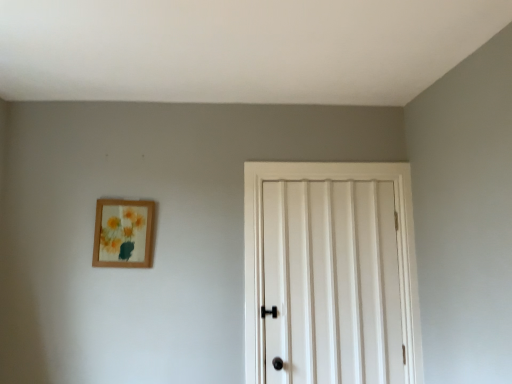
Question: Does wooden picture frame at upper left appear on the left side of white matte door at center?

Choices:
 (A) yes
 (B) no

Answer: (A)

Question: Is wooden picture frame at upper left located outside white matte door at center?

Choices:
 (A) yes
 (B) no

Answer: (A)

Question: Is wooden picture frame at upper left with white matte door at center?

Choices:
 (A) no
 (B) yes

Answer: (A)

Question: Can white matte door at center be found inside wooden picture frame at upper left?

Choices:
 (A) yes
 (B) no

Answer: (B)

Question: Considering the relative sizes of wooden picture frame at upper left and white matte door at center in the image provided, is wooden picture frame at upper left wider than white matte door at center?

Choices:
 (A) yes
 (B) no

Answer: (B)

Question: Considering the relative sizes of wooden picture frame at upper left and white matte door at center in the image provided, is wooden picture frame at upper left bigger than white matte door at center?

Choices:
 (A) yes
 (B) no

Answer: (B)

Question: Is white matte door at center positioned in front of wooden picture frame at upper left?

Choices:
 (A) no
 (B) yes

Answer: (B)

Question: Is there a large distance between white matte door at center and wooden picture frame at upper left?

Choices:
 (A) yes
 (B) no

Answer: (B)

Question: Is white matte door at center smaller than wooden picture frame at upper left?

Choices:
 (A) no
 (B) yes

Answer: (A)

Question: Does white matte door at center have a lesser width compared to wooden picture frame at upper left?

Choices:
 (A) yes
 (B) no

Answer: (B)

Question: Is white matte door at center next to wooden picture frame at upper left?

Choices:
 (A) yes
 (B) no

Answer: (B)

Question: Considering the relative sizes of white matte door at center and wooden picture frame at upper left in the image provided, is white matte door at center taller than wooden picture frame at upper left?

Choices:
 (A) yes
 (B) no

Answer: (A)

Question: Is point (292, 203) closer or farther from the camera than point (140, 258)?

Choices:
 (A) closer
 (B) farther

Answer: (B)